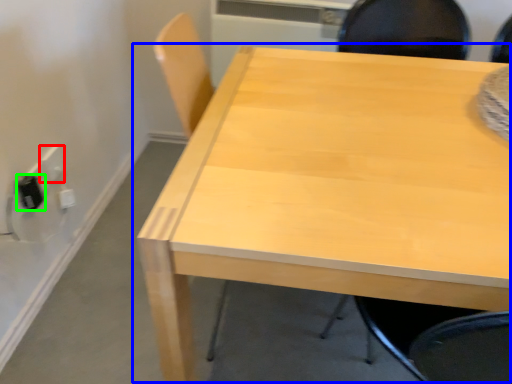
Question: Considering the real-world distances, which object is closest to electric outlet (highlighted by a red box)? table (highlighted by a blue box) or electric outlet (highlighted by a green box).

Choices:
 (A) table
 (B) electric outlet

Answer: (B)